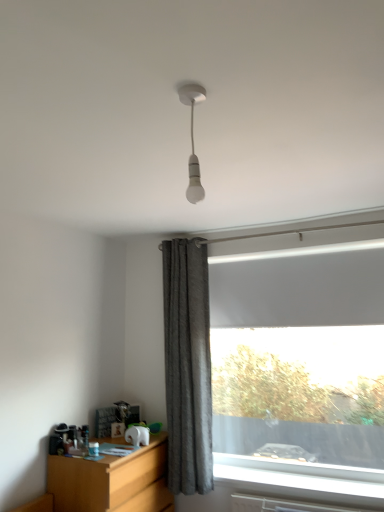
Question: Would you say wooden at left is inside or outside white matte bulb at upper center?

Choices:
 (A) outside
 (B) inside

Answer: (A)

Question: From a real-world perspective, relative to white matte bulb at upper center, is wooden at left vertically above or below?

Choices:
 (A) below
 (B) above

Answer: (A)

Question: Considering the real-world distances, which object is farthest from the gray textured curtain at center?

Choices:
 (A) white matte bulb at upper center
 (B) wooden at left

Answer: (A)

Question: Estimate the real-world distances between objects in this image. Which object is closer to the white matte bulb at upper center?

Choices:
 (A) wooden at left
 (B) gray textured curtain at center

Answer: (B)